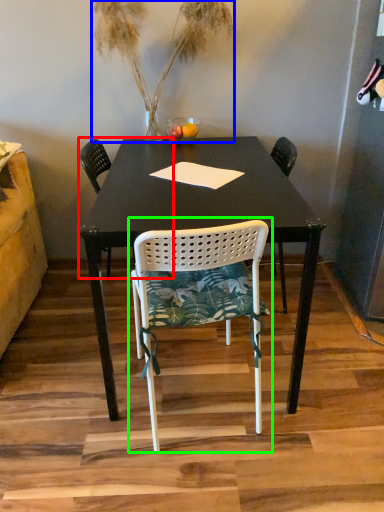
Question: Which object is the closest to the chair (highlighted by a red box)? Choose among these: houseplant (highlighted by a blue box) or chair (highlighted by a green box).

Choices:
 (A) houseplant
 (B) chair

Answer: (A)